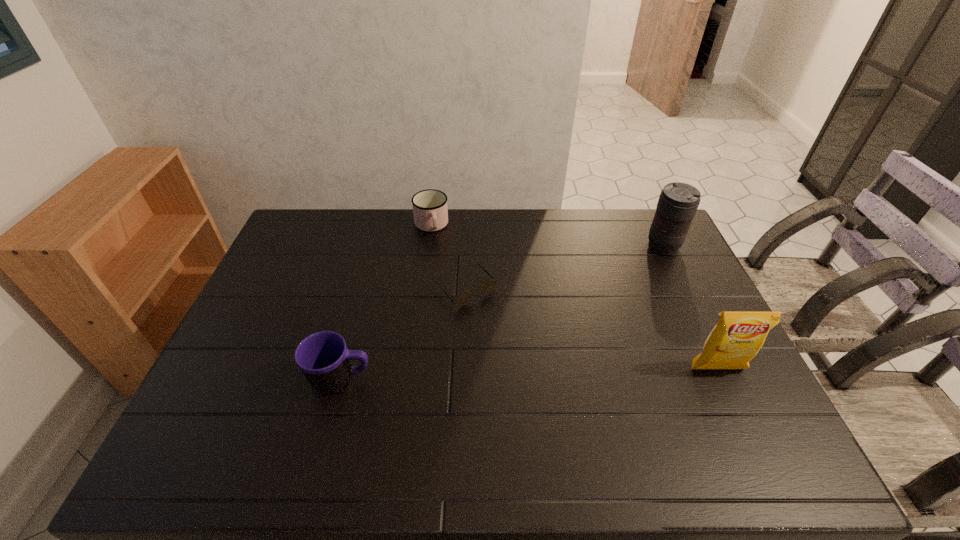
Where is `vacant space at the near right corner of the desktop`? The image size is (960, 540). vacant space at the near right corner of the desktop is located at coordinates (746, 402).

Find the location of a particular element. free area in between the fourth tallest object and the third shortest object is located at coordinates (386, 303).

Locate an element on the screen. The image size is (960, 540). vacant area between the leftmost object and the telephoto lens is located at coordinates (502, 313).

The height and width of the screenshot is (540, 960). Identify the location of vacant area between the telephoto lens and the nearer mug. (502, 313).

Where is `free spot between the sunglasses and the right mug`? This screenshot has height=540, width=960. free spot between the sunglasses and the right mug is located at coordinates (448, 257).

At what (x,y) coordinates should I click in order to perform the action: click on empty space between the crisp (potato chip) and the shorter mug. Please return your answer as a coordinate pair (x, y). The height and width of the screenshot is (540, 960). Looking at the image, I should click on (574, 298).

In order to click on free space between the crisp (potato chip) and the telephoto lens in this screenshot , I will do `click(690, 308)`.

This screenshot has height=540, width=960. What are the coordinates of `free space between the telephoto lens and the fourth tallest object` in the screenshot? It's located at (547, 236).

You are a GUI agent. You are given a task and a screenshot of the screen. Output one action in this format:
    pyautogui.click(x=<x>, y=<y>)
    Task: Click on the vacant area that lies between the third shortest object and the farther mug
    The image size is (960, 540).
    Given the screenshot: What is the action you would take?
    pyautogui.click(x=386, y=303)

Where is `free spot between the third farthest object and the nearer mug`? The image size is (960, 540). free spot between the third farthest object and the nearer mug is located at coordinates (404, 334).